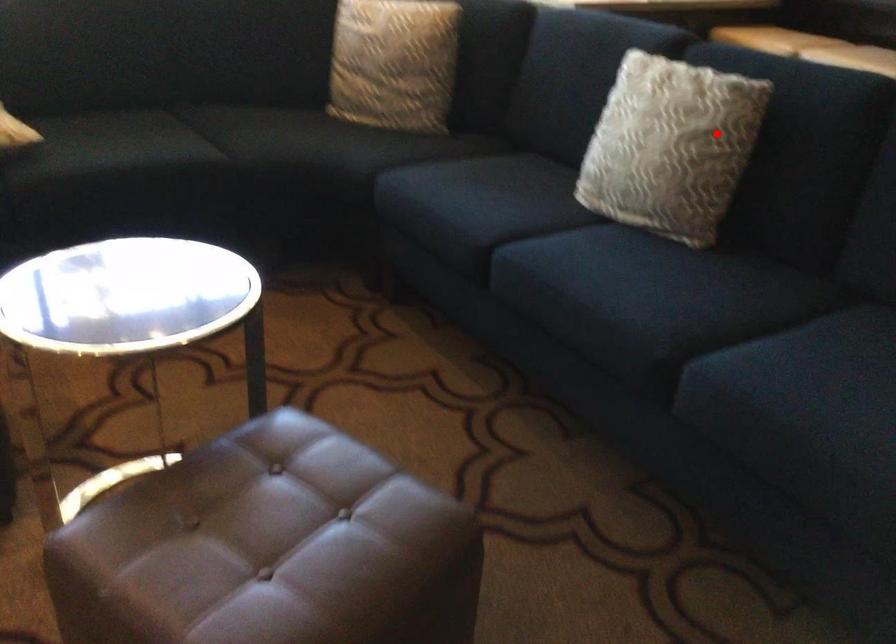
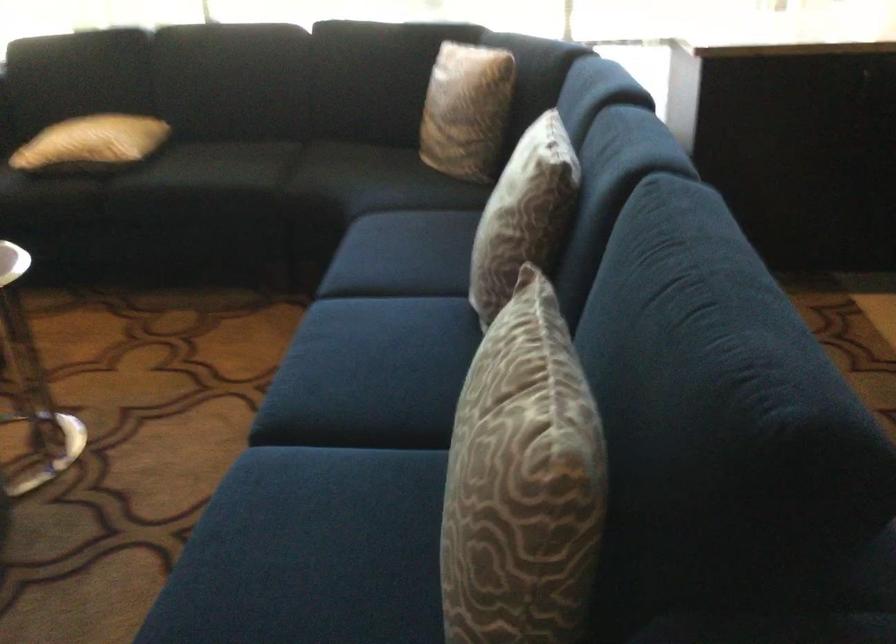
Question: I am providing you with two images of the same scene from different viewpoints. A red point is shown in image1. For the corresponding object point in image2, is it positioned nearer or farther from the camera?

Choices:
 (A) Nearer
 (B) Farther

Answer: (A)